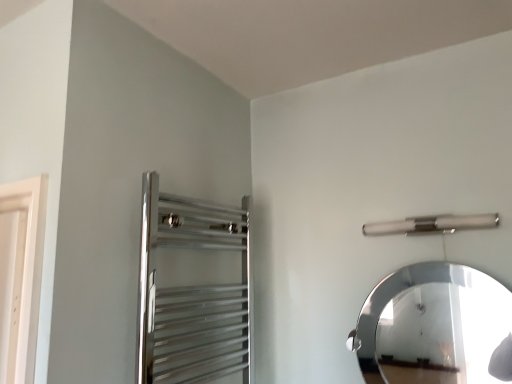
Question: Is polished silver mirror at upper right taller or shorter than polished chrome towel rack at upper left?

Choices:
 (A) short
 (B) tall

Answer: (A)

Question: Based on their sizes in the image, would you say polished silver mirror at upper right is bigger or smaller than polished chrome towel rack at upper left?

Choices:
 (A) small
 (B) big

Answer: (A)

Question: Considering the real-world distances, which object is closest to the satin nickel towel bar at upper right?

Choices:
 (A) polished silver mirror at upper right
 (B) polished chrome towel rack at upper left

Answer: (B)

Question: Which object is the closest to the satin nickel towel bar at upper right?

Choices:
 (A) polished chrome towel rack at upper left
 (B) polished silver mirror at upper right

Answer: (A)